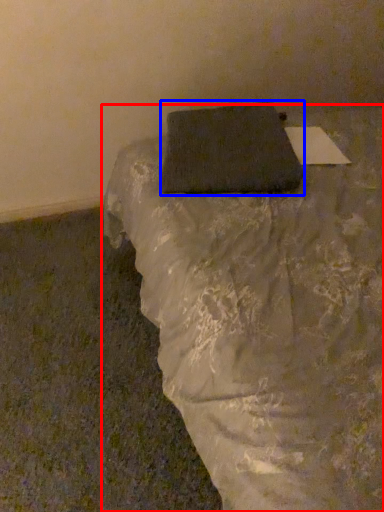
Question: Which point is further to the camera, furniture (highlighted by a red box) or pillow (highlighted by a blue box)?

Choices:
 (A) furniture
 (B) pillow

Answer: (B)